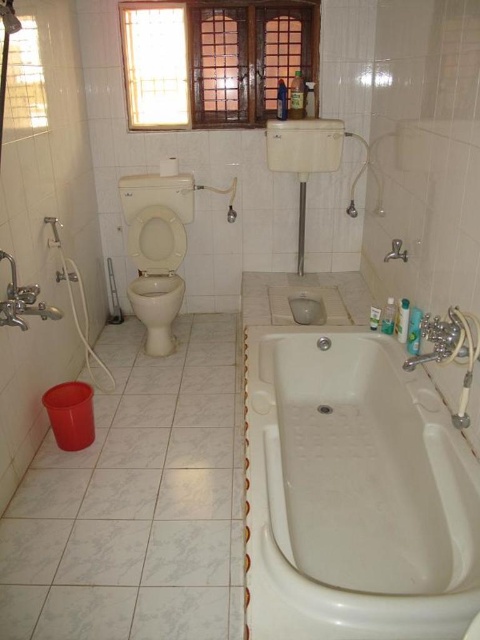
What do you see at coordinates (352, 493) in the screenshot?
I see `white glossy bathtub at lower right` at bounding box center [352, 493].

In the scene shown: Can you confirm if white glossy bathtub at lower right is smaller than wooden window at upper center?

Incorrect, white glossy bathtub at lower right is not smaller in size than wooden window at upper center.

Does point (345, 618) come behind point (148, 35)?

No, it is not.

Image resolution: width=480 pixels, height=640 pixels. I want to click on white glossy bathtub at lower right, so click(x=352, y=493).

Is wooden window at upper center further to the viewer compared to beige ceramic toilet bowl at center?

Yes, it is behind beige ceramic toilet bowl at center.

Between wooden window at upper center and beige ceramic toilet bowl at center, which one has more height?

wooden window at upper center

Who is more distant from viewer, (307, 20) or (167, 332)?

The point (167, 332) is behind.

Find the location of a particular element. This screenshot has width=480, height=640. wooden window at upper center is located at coordinates (213, 60).

How far apart are white glossy bathtub at lower right and white glossy sink at upper center?

They are 4.45 feet apart.

Is point (376, 422) farther from camera compared to point (272, 157)?

No, (376, 422) is in front of (272, 157).

I want to click on white glossy bathtub at lower right, so click(352, 493).

Where is `white glossy bathtub at lower right`? This screenshot has height=640, width=480. white glossy bathtub at lower right is located at coordinates (352, 493).